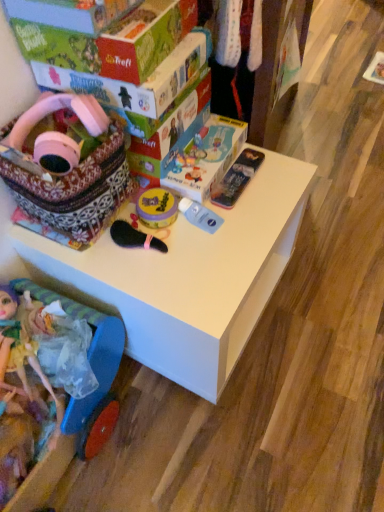
Locate an element on the screen. This screenshot has height=512, width=384. vacant area that lies in front of metallic plastic pencil case at upper right, arranged as the 1th toy when viewed from the right is located at coordinates (241, 229).